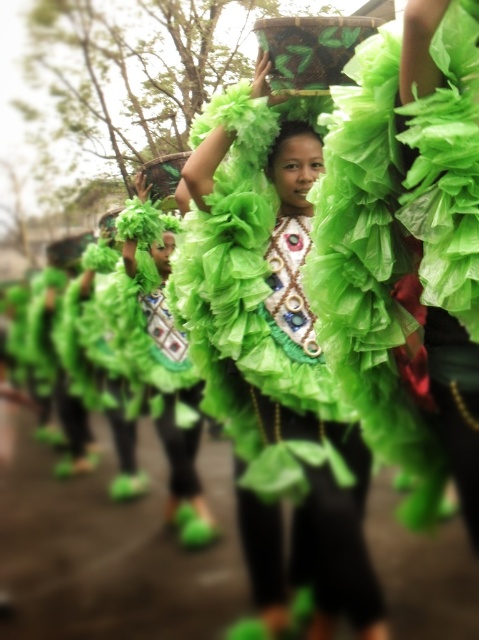
Question: From the image, what is the correct spatial relationship of green fabric dress at center in relation to ruffled green dress at center?

Choices:
 (A) above
 (B) below

Answer: (A)

Question: Which of the following is the closest to the observer?

Choices:
 (A) (182, 504)
 (B) (192, 272)

Answer: (B)

Question: Is green fabric dress at center to the left of ruffled green dress at center from the viewer's perspective?

Choices:
 (A) yes
 (B) no

Answer: (B)

Question: Among these objects, which one is farthest from the camera?

Choices:
 (A) ruffled green dress at center
 (B) green fabric dress at center

Answer: (A)

Question: Which of the following is the farthest from the observer?

Choices:
 (A) (226, 276)
 (B) (191, 536)

Answer: (B)

Question: Is green fabric dress at center below ruffled green dress at center?

Choices:
 (A) no
 (B) yes

Answer: (A)